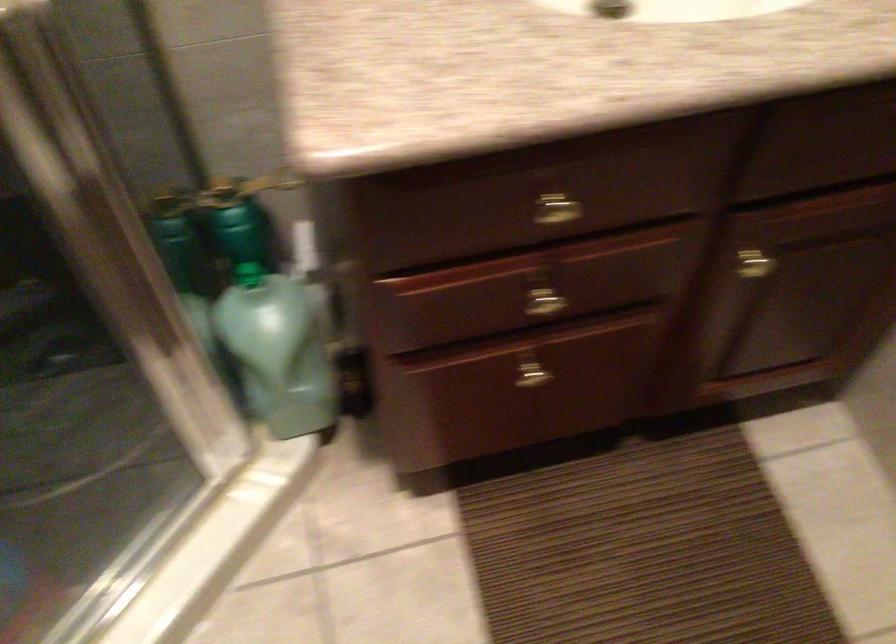
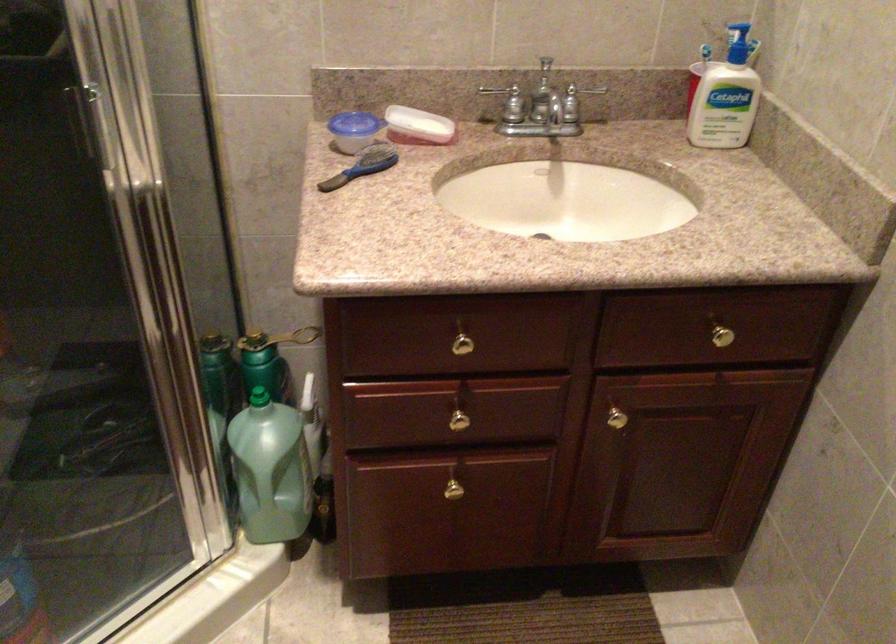
Find the pixel in the second image that matches point (737, 254) in the first image.

(612, 411)